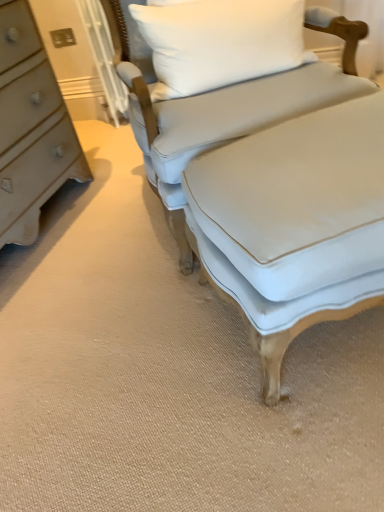
Question: Does white fabric pillow at upper center have a greater width compared to light blue fabric couch at center?

Choices:
 (A) no
 (B) yes

Answer: (A)

Question: From the image's perspective, is white fabric pillow at upper center under light blue fabric couch at center?

Choices:
 (A) no
 (B) yes

Answer: (A)

Question: Is white fabric pillow at upper center with light blue fabric couch at center?

Choices:
 (A) no
 (B) yes

Answer: (A)

Question: From a real-world perspective, is white fabric pillow at upper center over light blue fabric couch at center?

Choices:
 (A) no
 (B) yes

Answer: (B)

Question: Does white fabric pillow at upper center have a lesser height compared to light blue fabric couch at center?

Choices:
 (A) yes
 (B) no

Answer: (A)

Question: From a real-world perspective, is white fabric pillow at upper center physically below light blue fabric couch at center?

Choices:
 (A) no
 (B) yes

Answer: (A)

Question: Would you say white fabric pillow at upper center contains light blue fabric ottoman at center?

Choices:
 (A) no
 (B) yes

Answer: (A)

Question: From the image's perspective, is white fabric pillow at upper center on top of light blue fabric ottoman at center?

Choices:
 (A) yes
 (B) no

Answer: (A)

Question: Does white fabric pillow at upper center turn towards light blue fabric ottoman at center?

Choices:
 (A) no
 (B) yes

Answer: (A)

Question: From a real-world perspective, is white fabric pillow at upper center positioned over light blue fabric ottoman at center based on gravity?

Choices:
 (A) yes
 (B) no

Answer: (A)

Question: Is white fabric pillow at upper center at the left side of light blue fabric ottoman at center?

Choices:
 (A) yes
 (B) no

Answer: (A)

Question: Can you confirm if white fabric pillow at upper center is smaller than light blue fabric ottoman at center?

Choices:
 (A) no
 (B) yes

Answer: (B)

Question: Would you say light blue fabric couch at center is outside light blue fabric ottoman at center?

Choices:
 (A) yes
 (B) no

Answer: (A)